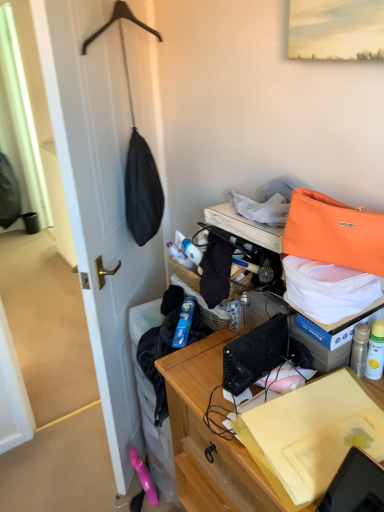
Question: Does orange leather handbag at upper right have a larger size compared to wooden desk at center?

Choices:
 (A) no
 (B) yes

Answer: (A)

Question: From a real-world perspective, does orange leather handbag at upper right stand above wooden desk at center?

Choices:
 (A) yes
 (B) no

Answer: (A)

Question: Does orange leather handbag at upper right appear on the right side of wooden desk at center?

Choices:
 (A) yes
 (B) no

Answer: (A)

Question: Is orange leather handbag at upper right shorter than wooden desk at center?

Choices:
 (A) no
 (B) yes

Answer: (B)

Question: From a real-world perspective, is orange leather handbag at upper right physically below wooden desk at center?

Choices:
 (A) no
 (B) yes

Answer: (A)

Question: Could you tell me if orange leather handbag at upper right is facing wooden desk at center?

Choices:
 (A) no
 (B) yes

Answer: (A)

Question: From the image's perspective, is matte black coat hanger at left below wooden desk at center?

Choices:
 (A) yes
 (B) no

Answer: (B)

Question: From the image's perspective, is matte black coat hanger at left over wooden desk at center?

Choices:
 (A) yes
 (B) no

Answer: (A)

Question: Is matte black coat hanger at left at the right side of wooden desk at center?

Choices:
 (A) yes
 (B) no

Answer: (B)

Question: Can wooden desk at center be found inside matte black coat hanger at left?

Choices:
 (A) no
 (B) yes

Answer: (A)

Question: Is matte black coat hanger at left looking in the opposite direction of wooden desk at center?

Choices:
 (A) yes
 (B) no

Answer: (B)

Question: Is matte black coat hanger at left facing towards wooden desk at center?

Choices:
 (A) yes
 (B) no

Answer: (B)

Question: Is orange leather handbag at upper right taller than wooden desk at center?

Choices:
 (A) yes
 (B) no

Answer: (B)